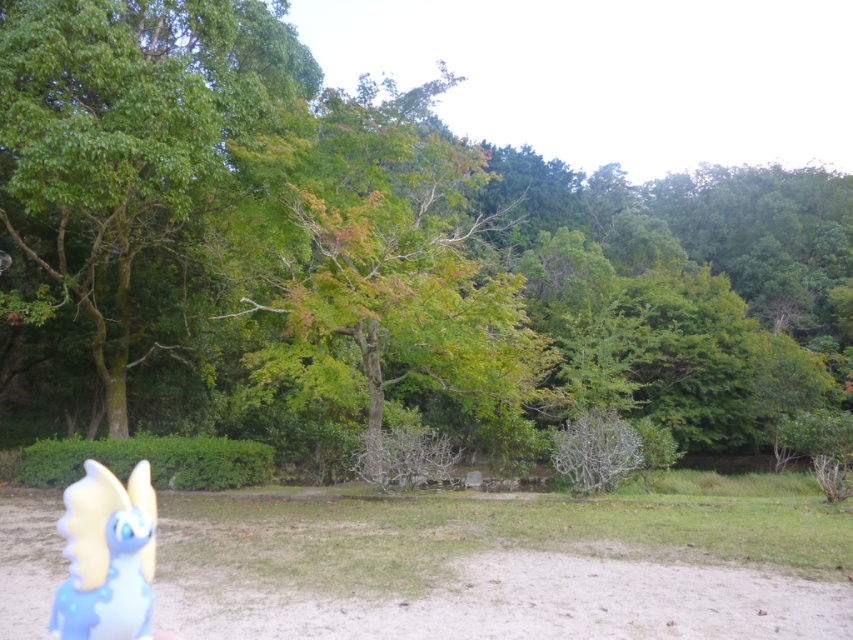
Question: Which of the following is the closest to the observer?

Choices:
 (A) (236, 106)
 (B) (93, 630)
 (C) (579, 509)

Answer: (B)

Question: Which of the following is the farthest from the observer?

Choices:
 (A) translucent blue plastic toy at lower left
 (B) green leafy tree at left

Answer: (B)

Question: Is brown sandy dirt at center bigger than translucent blue plastic toy at lower left?

Choices:
 (A) yes
 (B) no

Answer: (A)

Question: Does brown sandy dirt at center have a greater width compared to green leafy tree at left?

Choices:
 (A) no
 (B) yes

Answer: (B)

Question: Which of these objects is positioned closest to the translucent blue plastic toy at lower left?

Choices:
 (A) brown sandy dirt at center
 (B) green leafy tree at left

Answer: (A)

Question: Is brown sandy dirt at center below green leafy tree at left?

Choices:
 (A) no
 (B) yes

Answer: (B)